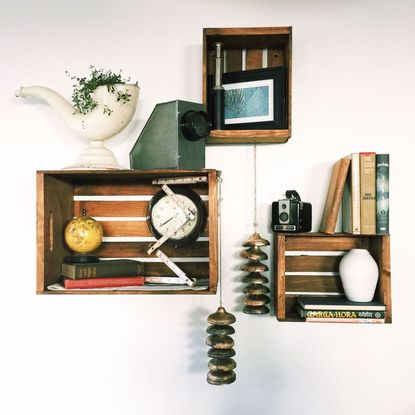
Identify the location of vase. This screenshot has height=415, width=415. (106, 122).